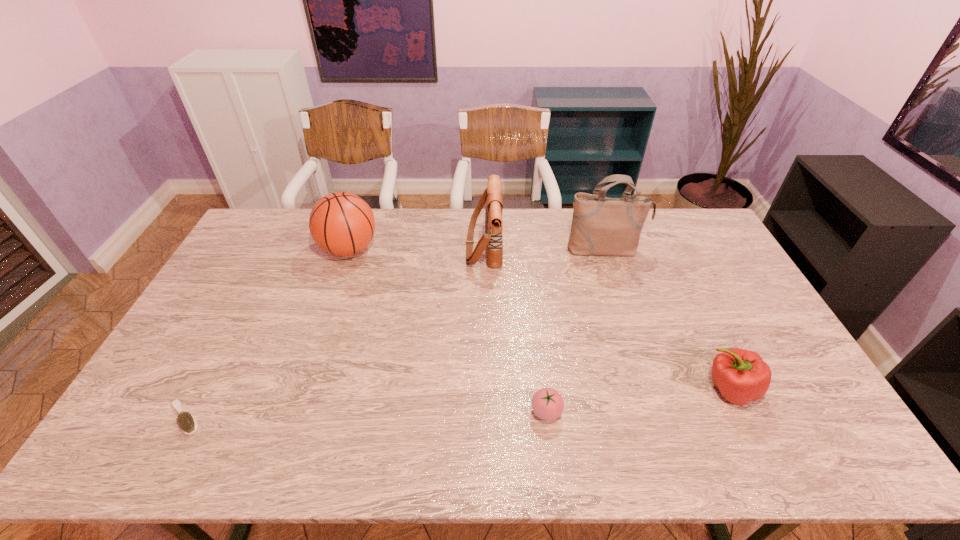
I want to click on object present at the near edge, so click(187, 423).

The width and height of the screenshot is (960, 540). What are the coordinates of `object present at the left edge` in the screenshot? It's located at (187, 423).

Identify the location of object positioned at the right edge. (741, 376).

The image size is (960, 540). What are the coordinates of `object that is positioned at the near left corner` in the screenshot? It's located at (187, 423).

At what (x,y) coordinates should I click in order to perform the action: click on blank area at the far edge. Please return your answer as a coordinate pair (x, y). Looking at the image, I should click on (547, 225).

The width and height of the screenshot is (960, 540). In the image, there is a desktop. Find the location of `vacant space at the near edge`. vacant space at the near edge is located at coordinates (744, 433).

I want to click on vacant space at the left edge of the desktop, so click(x=216, y=333).

This screenshot has height=540, width=960. What are the coordinates of `vacant space at the right edge of the desktop` in the screenshot? It's located at (724, 266).

In the image, there is a desktop. Identify the location of vacant space at the far left corner. (269, 238).

Where is `vacant space at the far right corner`? This screenshot has height=540, width=960. vacant space at the far right corner is located at coordinates (692, 228).